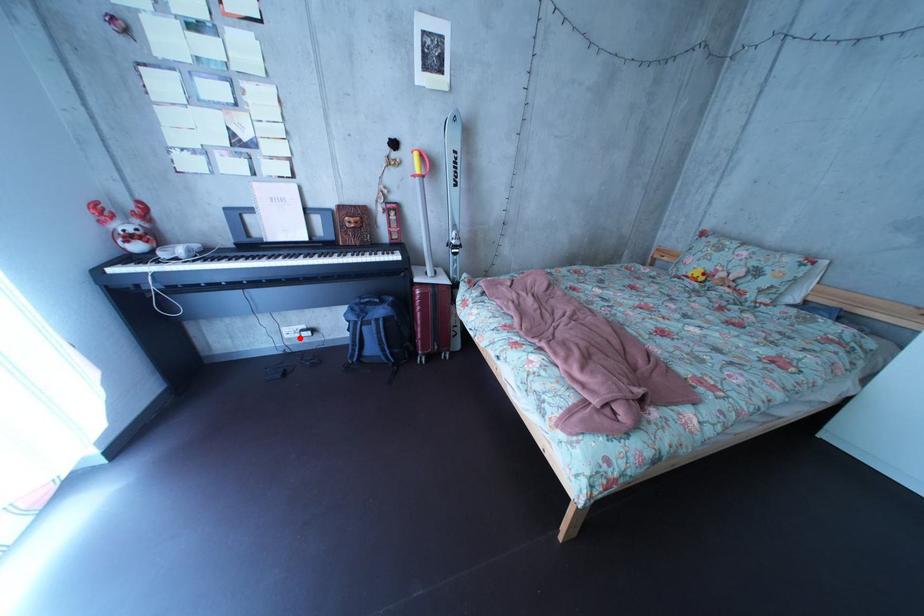
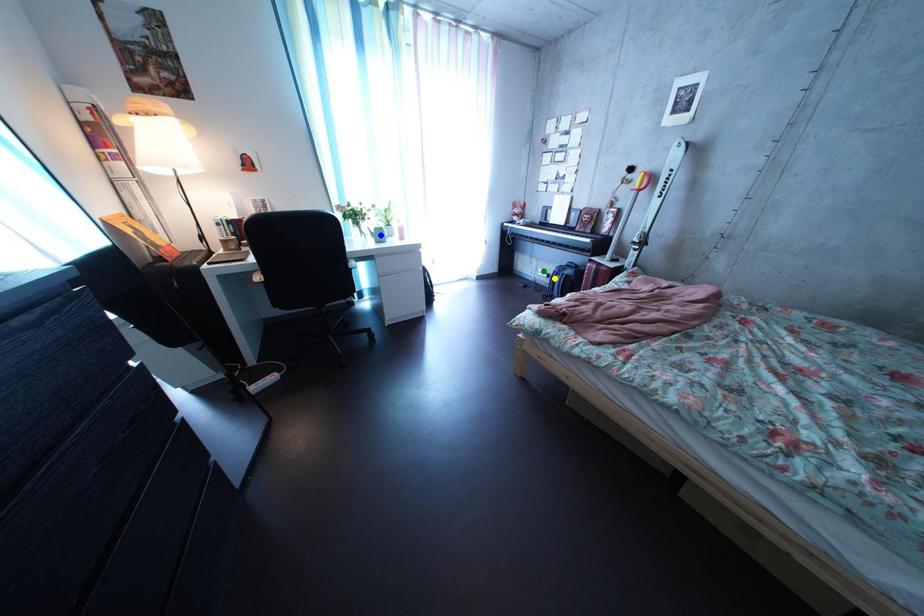
Question: I am providing you with two images of the same scene from different viewpoints. A red point is marked on the first image. You are given multiple points on the second image. In image 2, which mark is for the same physical point as the one in image 1?

Choices:
 (A) yellow point
 (B) green point
 (C) blue point

Answer: (A)